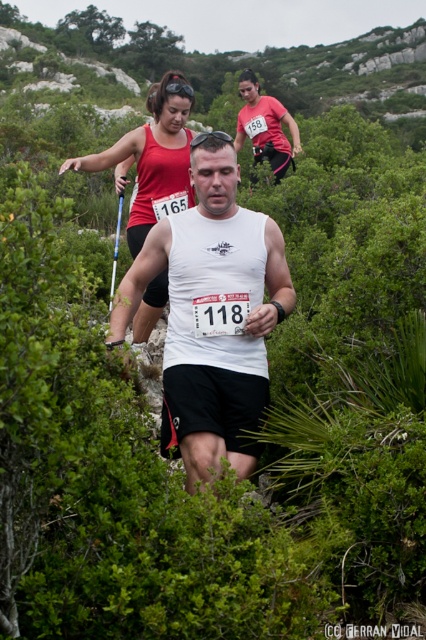
You are a photographer positioned at the starting line of the trail race. You want to capture both the white matte tank top at center and the matte red tank top at center in a single shot. Which runner should you focus on first to ensure both are in frame?

The white matte tank top at center is thinner than the matte red tank top at center, so you should focus on the white matte tank top at center first to ensure both are in frame.

You are a race official trying to determine the current standings of the runners. Based on the image, which runner is leading between the matte red tank top at center and the matte white tank top at center?

The matte red tank top at center is in front of the matte white tank top at center, so the runner wearing the matte red tank top at center is leading.